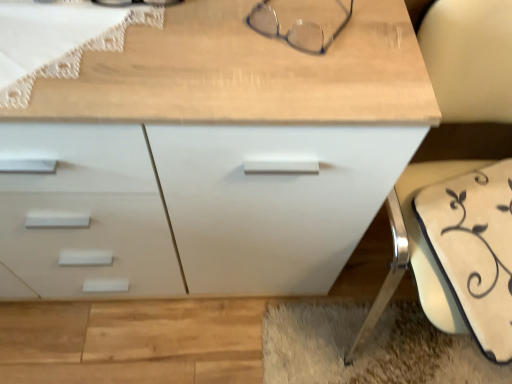
I want to click on free spot below clear plastic glasses at upper center (from a real-world perspective), so click(x=301, y=24).